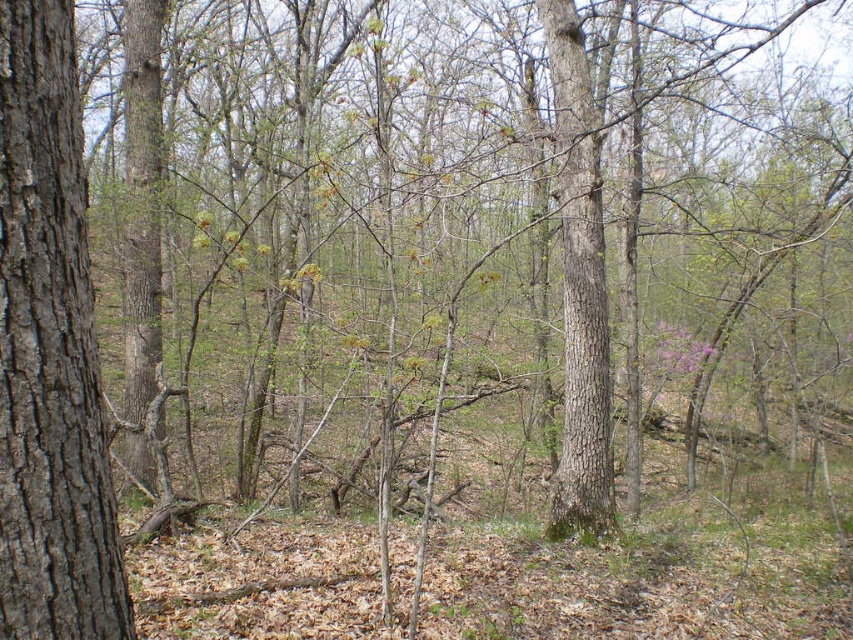
What do you see at coordinates (50, 352) in the screenshot?
I see `gray rough bark tree trunk at left` at bounding box center [50, 352].

Is point (44, 552) positioned before point (554, 88)?

Yes, point (44, 552) is closer to viewer.

Locate an element on the screen. gray rough bark tree trunk at left is located at coordinates (50, 352).